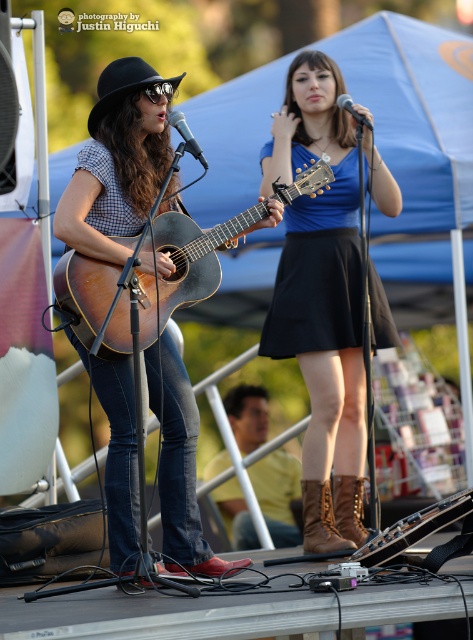
Question: Can you confirm if black matte dress at center is wider than metallic silver microphone at upper center?

Choices:
 (A) yes
 (B) no

Answer: (A)

Question: Can you confirm if acoustic wood guitar at center is smaller than brown leather cowboy boot at lower center?

Choices:
 (A) no
 (B) yes

Answer: (A)

Question: Among these points, which one is farthest from the camera?

Choices:
 (A) (285, 515)
 (B) (344, 307)
 (C) (116, 64)

Answer: (A)

Question: Which object is positioned farthest from the black matte dress at center?

Choices:
 (A) black felt fedora at center
 (B) brown suede cowboy boot at lower right
 (C) brown leather cowboy boot at lower center
 (D) blue suede skirt at center

Answer: (A)

Question: Is matte brown guitar at left positioned behind brown leather boots at lower center?

Choices:
 (A) yes
 (B) no

Answer: (B)

Question: Which point is farther to the camera?

Choices:
 (A) blue suede skirt at center
 (B) brown leather boots at lower center
 (C) black felt fedora at center
 (D) matte brown guitar at left

Answer: (B)